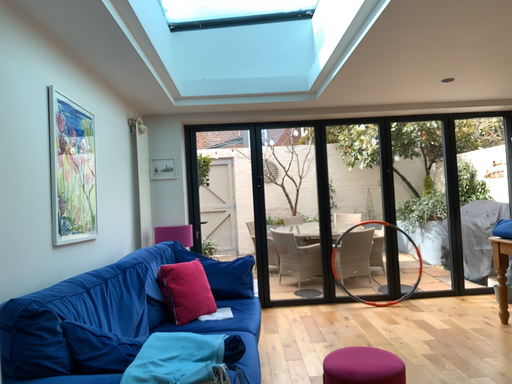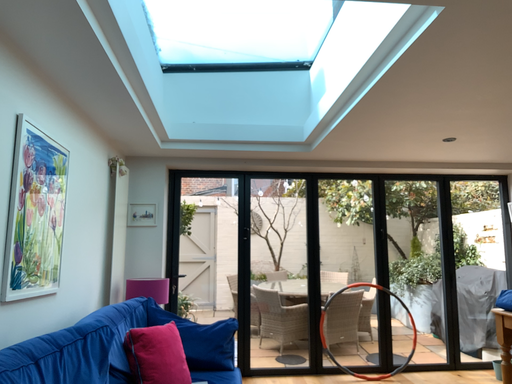
Question: How did the camera likely rotate when shooting the video?

Choices:
 (A) rotated downward
 (B) rotated upward

Answer: (B)